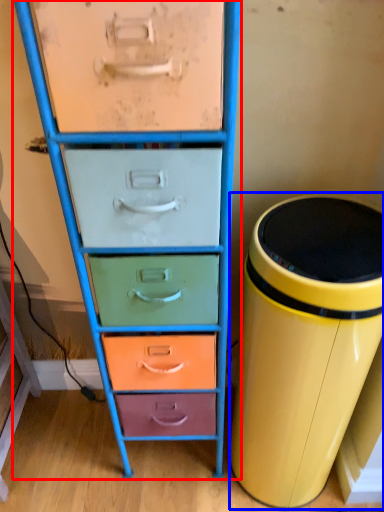
Question: Which point is closer to the camera, chest of drawers (highlighted by a red box) or waste container (highlighted by a blue box)?

Choices:
 (A) chest of drawers
 (B) waste container

Answer: (A)